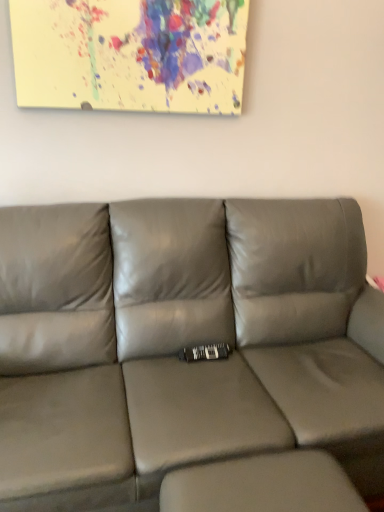
Question: From their relative heights in the image, would you say satin gray leather couch at center is taller or shorter than gray leather footrest at lower right?

Choices:
 (A) short
 (B) tall

Answer: (B)

Question: Is satin gray leather couch at center wider or thinner than gray leather footrest at lower right?

Choices:
 (A) thin
 (B) wide

Answer: (B)

Question: From the image's perspective, is satin gray leather couch at center located above or below gray leather footrest at lower right?

Choices:
 (A) above
 (B) below

Answer: (A)

Question: Is gray leather footrest at lower right situated inside satin gray leather couch at center or outside?

Choices:
 (A) inside
 (B) outside

Answer: (B)

Question: Considering the positions of gray leather footrest at lower right and satin gray leather couch at center in the image, is gray leather footrest at lower right taller or shorter than satin gray leather couch at center?

Choices:
 (A) short
 (B) tall

Answer: (A)

Question: In the image, is gray leather footrest at lower right on the left side or the right side of satin gray leather couch at center?

Choices:
 (A) right
 (B) left

Answer: (A)

Question: Considering the positions of gray leather footrest at lower right and satin gray leather couch at center in the image, is gray leather footrest at lower right wider or thinner than satin gray leather couch at center?

Choices:
 (A) wide
 (B) thin

Answer: (B)